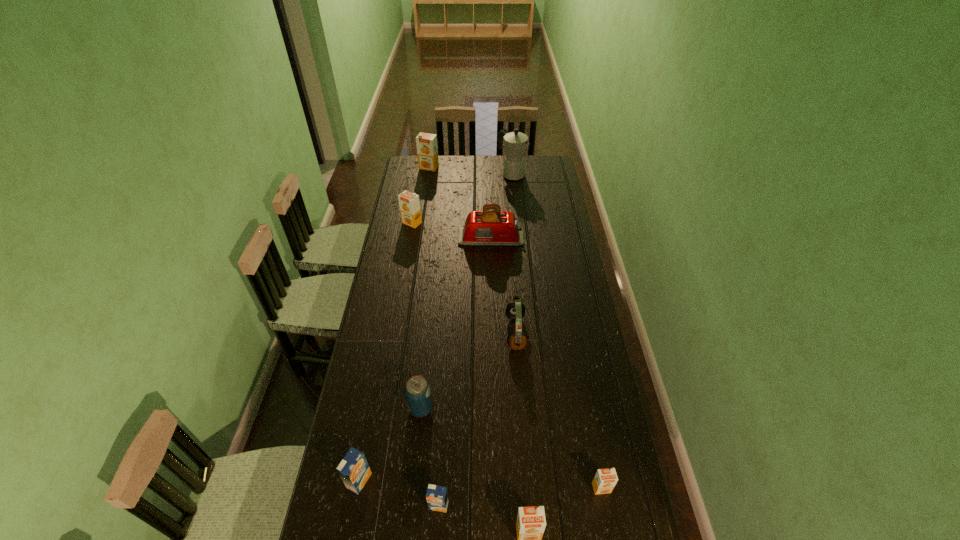
Where is `vacant area located on the ear cups of the fifth farthest object`? The image size is (960, 540). vacant area located on the ear cups of the fifth farthest object is located at coordinates (478, 333).

The image size is (960, 540). In order to click on vacant region located 0.330m on the ear cups of the fifth farthest object in this screenshot , I will do `click(423, 333)`.

Find the location of a particular element. Image resolution: width=960 pixels, height=540 pixels. free space located on the ear cups of the fifth farthest object is located at coordinates (419, 333).

The image size is (960, 540). I want to click on vacant space located 0.100m on the right of the sixth farthest object, so click(x=462, y=408).

The height and width of the screenshot is (540, 960). I want to click on vacant point located 0.080m on the right of the bigger blue orange_juice, so click(x=396, y=481).

Where is `vacant space located 0.120m on the left of the rightmost orange orange juice`? vacant space located 0.120m on the left of the rightmost orange orange juice is located at coordinates (553, 488).

This screenshot has height=540, width=960. I want to click on free space located on the right of the smaller blue orange_juice, so click(522, 505).

I want to click on coffeepot situated at the far edge, so [x=516, y=143].

The height and width of the screenshot is (540, 960). Identify the location of orange juice that is at the far edge. (427, 150).

This screenshot has width=960, height=540. Identify the location of object positioned at the right edge. (605, 480).